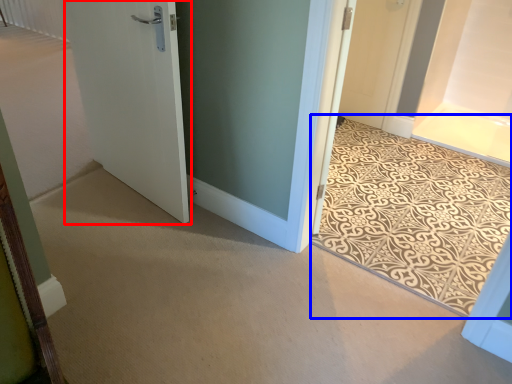
Question: Among these objects, which one is farthest to the camera, door (highlighted by a red box) or doormat (highlighted by a blue box)?

Choices:
 (A) door
 (B) doormat

Answer: (A)